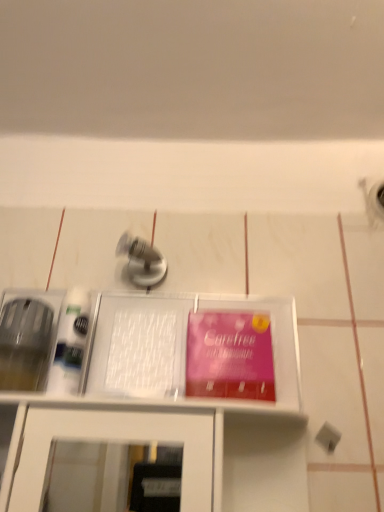
Question: From a real-world perspective, does white plastic tray at center stand above pink matte paper at center?

Choices:
 (A) yes
 (B) no

Answer: (A)

Question: Is white plastic tray at center wider than pink matte paper at center?

Choices:
 (A) yes
 (B) no

Answer: (A)

Question: Is white plastic tray at center to the right of pink matte paper at center from the viewer's perspective?

Choices:
 (A) no
 (B) yes

Answer: (A)

Question: Is white plastic tray at center with pink matte paper at center?

Choices:
 (A) yes
 (B) no

Answer: (A)

Question: Is the position of white plastic tray at center more distant than that of pink matte paper at center?

Choices:
 (A) no
 (B) yes

Answer: (B)

Question: Considering the relative sizes of white plastic tray at center and pink matte paper at center in the image provided, is white plastic tray at center thinner than pink matte paper at center?

Choices:
 (A) no
 (B) yes

Answer: (A)

Question: Does pink matte paper at center have a greater width compared to white plastic tray at center?

Choices:
 (A) yes
 (B) no

Answer: (B)

Question: From a real-world perspective, is pink matte paper at center located beneath white plastic tray at center?

Choices:
 (A) yes
 (B) no

Answer: (A)

Question: Does pink matte paper at center turn towards white plastic tray at center?

Choices:
 (A) no
 (B) yes

Answer: (A)

Question: Considering the relative sizes of pink matte paper at center and white plastic tray at center in the image provided, is pink matte paper at center thinner than white plastic tray at center?

Choices:
 (A) yes
 (B) no

Answer: (A)

Question: Is pink matte paper at center to the left of white plastic tray at center from the viewer's perspective?

Choices:
 (A) yes
 (B) no

Answer: (B)

Question: Can white plastic tray at center be found inside pink matte paper at center?

Choices:
 (A) yes
 (B) no

Answer: (B)

Question: Is satin nickel faucet at center oriented towards white plastic tray at center?

Choices:
 (A) no
 (B) yes

Answer: (A)